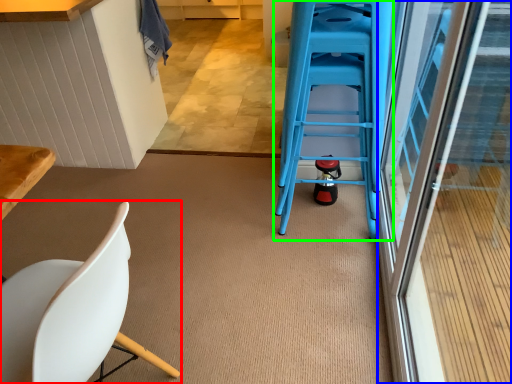
Question: Based on their relative distances, which object is nearer to chair (highlighted by a red box)? Choose from screen door (highlighted by a blue box) and ladder (highlighted by a green box).

Choices:
 (A) screen door
 (B) ladder

Answer: (B)